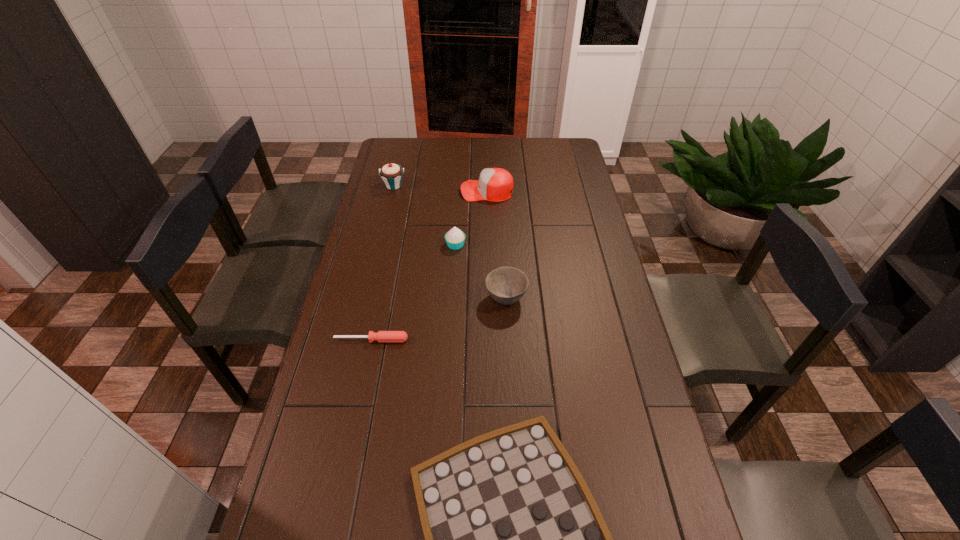
Locate an element on the screen. The height and width of the screenshot is (540, 960). the taller cupcake is located at coordinates (391, 174).

Identify the location of the left cupcake. (391, 174).

You are a GUI agent. You are given a task and a screenshot of the screen. Output one action in this format:
    pyautogui.click(x=<x>, y=<y>)
    Task: Click on the baseball cap
    The image size is (960, 540).
    Given the screenshot: What is the action you would take?
    [x=495, y=184]

The width and height of the screenshot is (960, 540). I want to click on the third farthest object, so click(x=455, y=238).

Where is `the nearer cupcake`? the nearer cupcake is located at coordinates (455, 238).

Identify the location of bowl. The width and height of the screenshot is (960, 540). (506, 285).

Identify the location of screwdriver. (382, 336).

You are a GUI agent. You are given a task and a screenshot of the screen. Output one action in this format:
    pyautogui.click(x=<x>, y=<y>)
    Task: Click on the fifth tallest object
    The width and height of the screenshot is (960, 540).
    Given the screenshot: What is the action you would take?
    pyautogui.click(x=382, y=336)

Locate an element on the screen. The height and width of the screenshot is (540, 960). vacant space located on the front of the farther cupcake is located at coordinates (389, 207).

The height and width of the screenshot is (540, 960). What are the coordinates of `free space located 0.170m on the front-facing side of the baseball cap` in the screenshot? It's located at (421, 191).